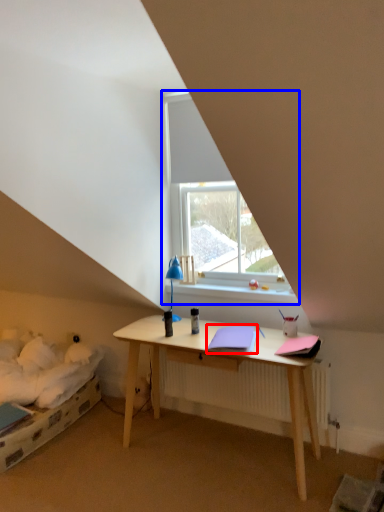
Question: Which point is further to the camera, notebook (highlighted by a red box) or window (highlighted by a blue box)?

Choices:
 (A) notebook
 (B) window

Answer: (B)